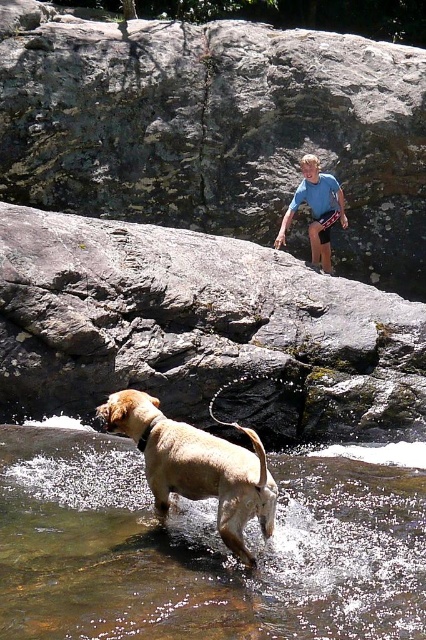
Question: Among these points, which one is farthest from the camera?

Choices:
 (A) (78, 496)
 (B) (222, 486)

Answer: (A)

Question: Is golden fur dog at lower center positioned in front of blue cotton shirt at upper center?

Choices:
 (A) no
 (B) yes

Answer: (B)

Question: Estimate the real-world distances between objects in this image. Which object is closer to the golden fur dog at lower center?

Choices:
 (A) gray rock at upper center
 (B) brown smooth water at lower left

Answer: (B)

Question: Which of these objects is positioned farthest from the brown smooth water at lower left?

Choices:
 (A) gray rock at upper center
 (B) blue cotton shirt at upper center

Answer: (B)

Question: Does gray rock at upper center have a greater width compared to blue cotton shirt at upper center?

Choices:
 (A) no
 (B) yes

Answer: (B)

Question: Can you confirm if gray rock at upper center is bigger than blue cotton shirt at upper center?

Choices:
 (A) no
 (B) yes

Answer: (B)